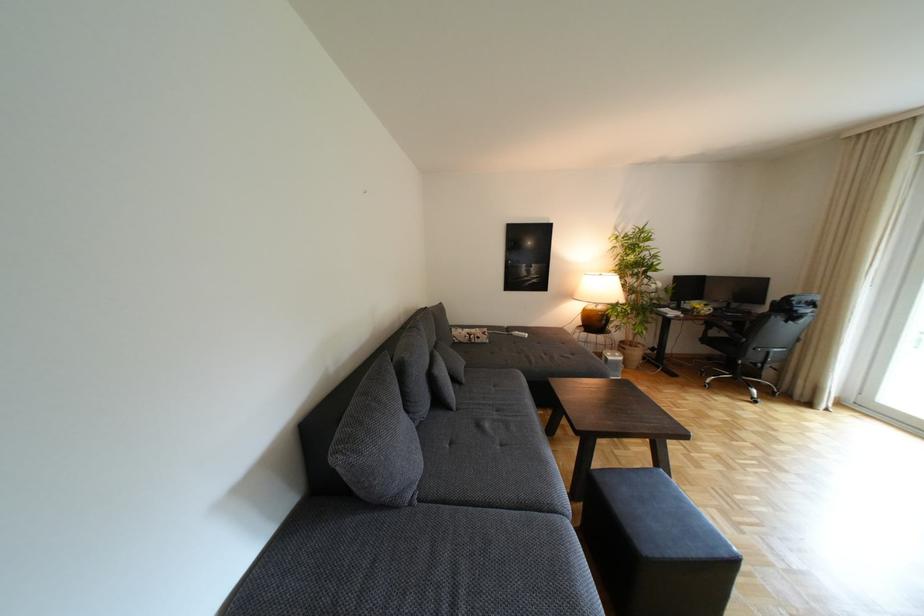
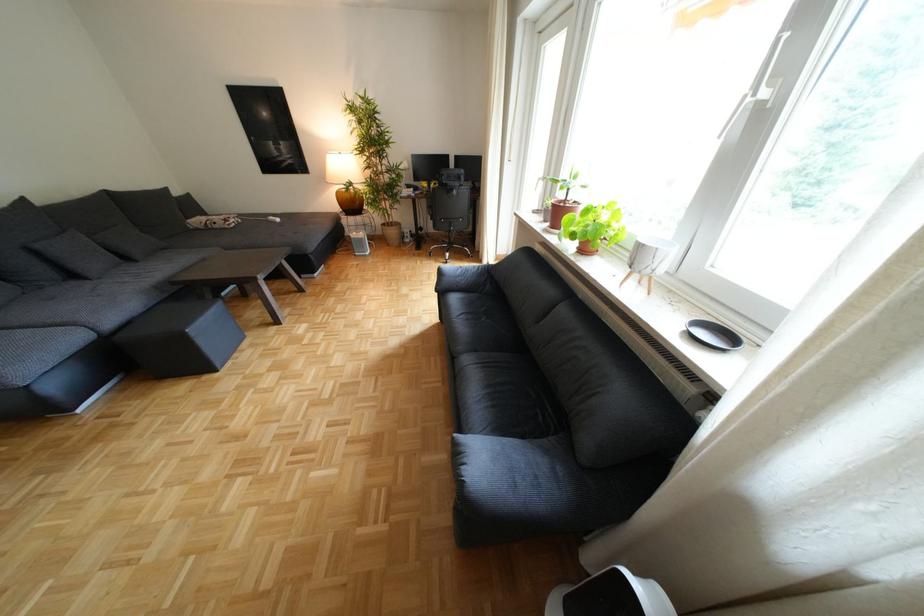
Locate, in the second image, the point that corresponds to [444,379] in the first image.

(49, 253)